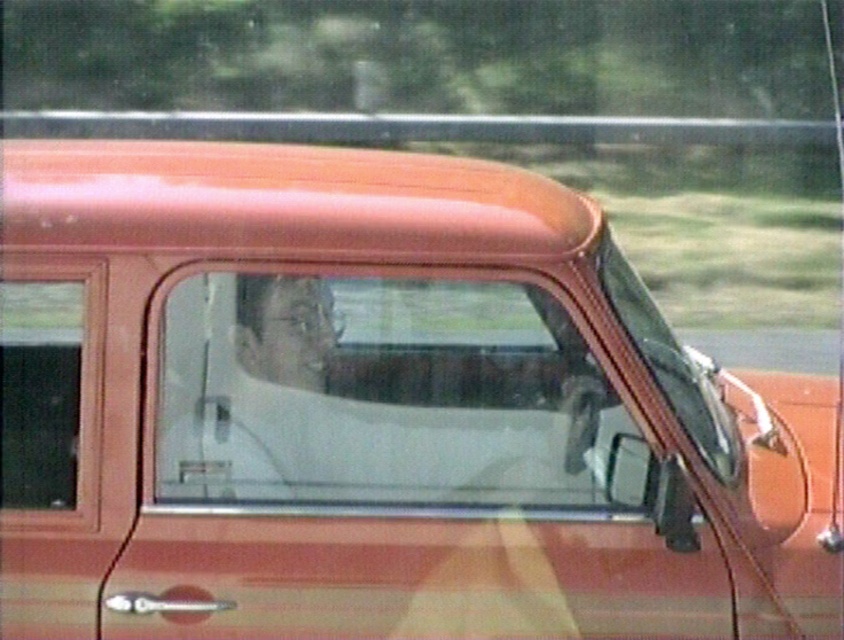
You are a mechanic inspecting the vintage car from the side. You notice two windows in the passenger area. Which window is located lower down on the car, the clear glass window at center or the transparent glass window at left?

The clear glass window at center is positioned under the transparent glass window at left, meaning it is lower down on the car.